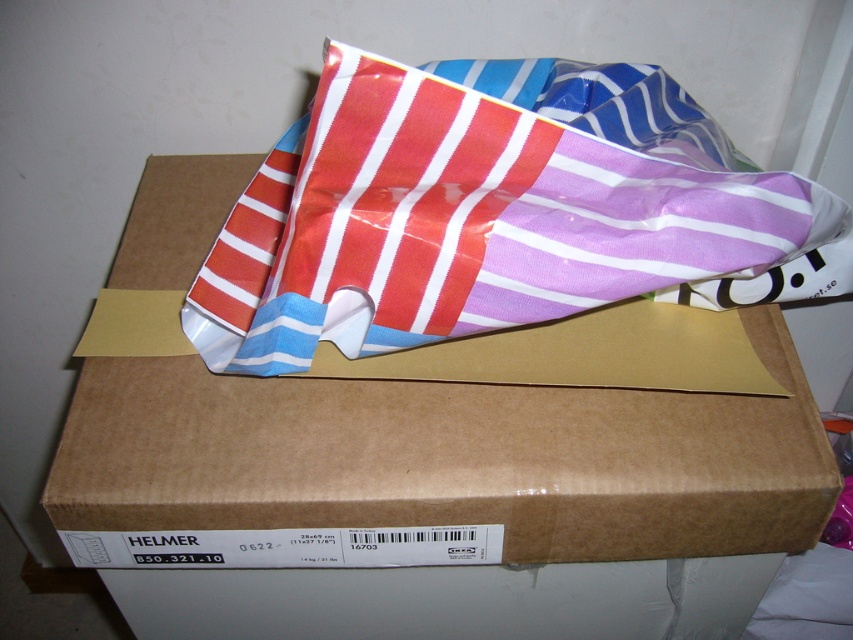
You are trying to determine if the striped plastic bag at center can fit inside the brown cardboard box at center. Based on their sizes, what is your conclusion?

The brown cardboard box at center is bigger than the striped plastic bag at center, so the striped plastic bag at center can fit inside the brown cardboard box at center.

You are standing in front of a cardboard box labeled HELMER from IKEA. There is a colorful striped fabric bag on top of the box. If you want to reach a point that is 24.55 inches away from you, can you reach it by extending your arm towards the point at coordinates (544, 509)?

The point at coordinates (544, 509) is 24.55 inches away from you, so yes, you can reach it by extending your arm towards that point.

You are trying to locate the brown cardboard box at center in a warehouse. According to the coordinates provided, where would you find it?

The brown cardboard box at center is located at point (450, 496), so you can find it there.